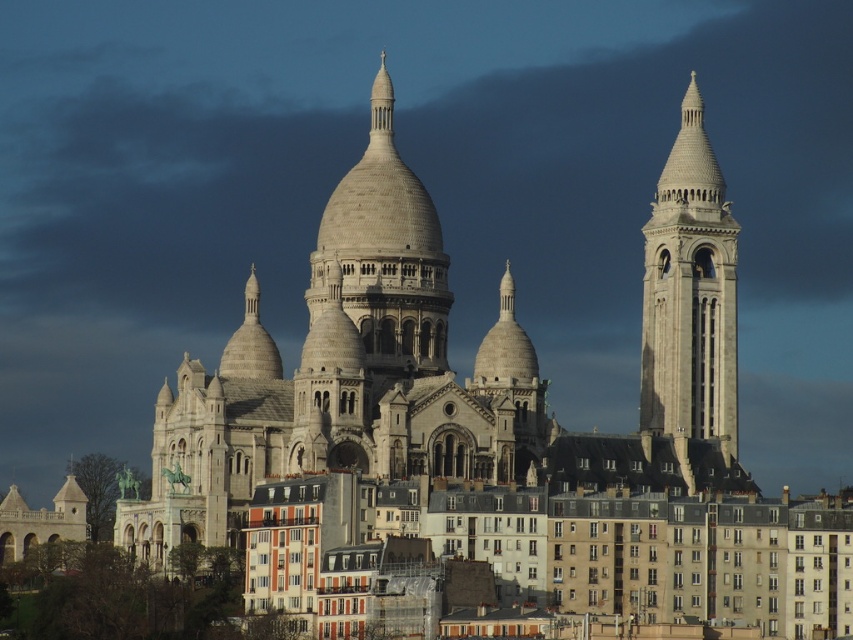
You are standing in front of the Basilica of the Sacred Heart of Paris and want to take a photo of the white stone tower at right and the beige stone dome at center. Which object should you focus on first if you want to capture both in a single frame without moving your camera?

You should focus on the beige stone dome at center first because the white stone tower at right is positioned under it, meaning the dome is higher up and the tower is lower, allowing both to be captured in one frame by centering on the dome.

You are standing at the point marked as point (689, 292) in the image of the Sacre Coeur Basilica. What object is located at this specific coordinate?

The white stone tower at right is located at point (689, 292).

You are a tour guide standing at the base of the beige stone dome at center. You want to walk to the white stone tower at right. How many steps would you need to take if each step covers 2.5 feet?

The distance between the white stone tower at right and beige stone dome at center is 47.11 feet. Dividing this by 2.5 feet per step gives approximately 18.84 steps. Since you can only take whole steps, you would need to take 19 steps to reach the white stone tower at right.